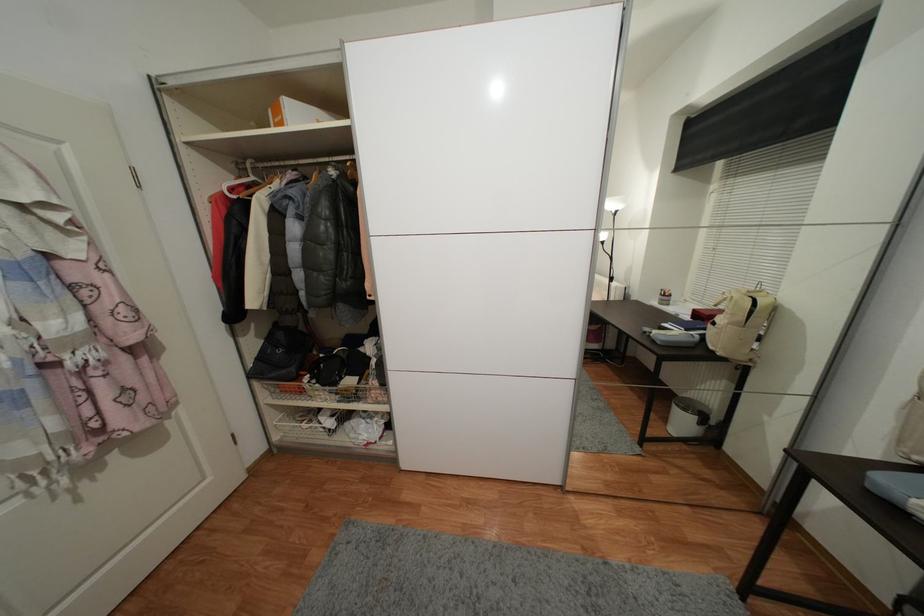
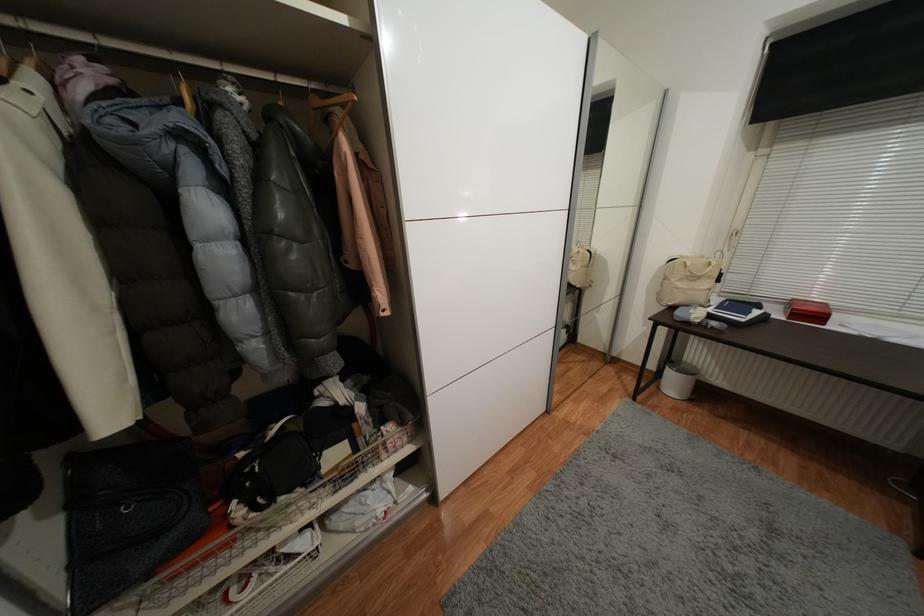
Locate, in the second image, the point that corresponds to (727,361) in the first image.

(582, 291)